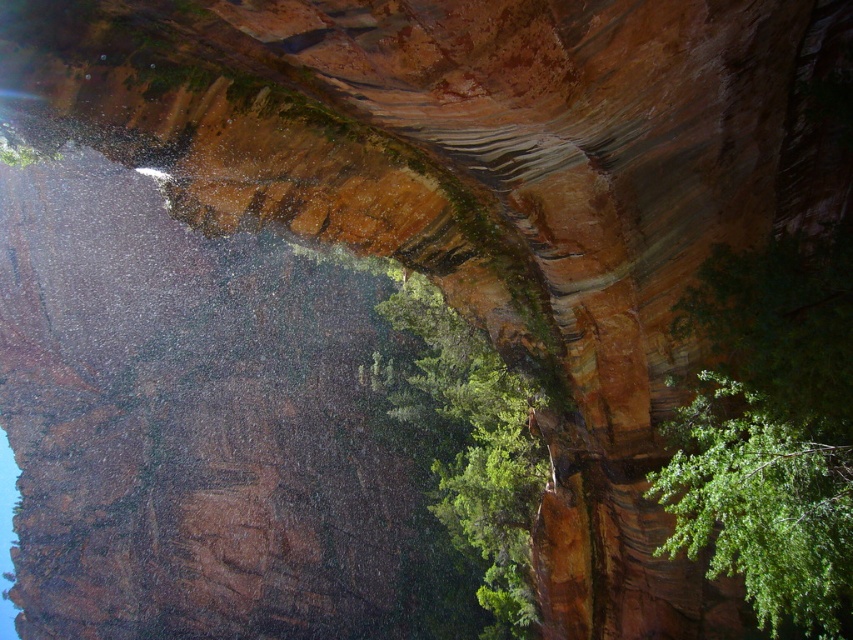
Question: Which of the following is the closest to the observer?

Choices:
 (A) (498, 618)
 (B) (809, 515)

Answer: (B)

Question: Does green leafy tree at right appear on the left side of green leafy tree at center?

Choices:
 (A) no
 (B) yes

Answer: (A)

Question: Which object appears farthest from the camera in this image?

Choices:
 (A) green leafy tree at center
 (B) green leafy tree at right

Answer: (A)

Question: Is green leafy tree at right wider than green leafy tree at center?

Choices:
 (A) no
 (B) yes

Answer: (A)

Question: Which point appears closest to the camera in this image?

Choices:
 (A) (502, 401)
 (B) (802, 586)

Answer: (B)

Question: Can you confirm if green leafy tree at right is smaller than green leafy tree at center?

Choices:
 (A) no
 (B) yes

Answer: (B)